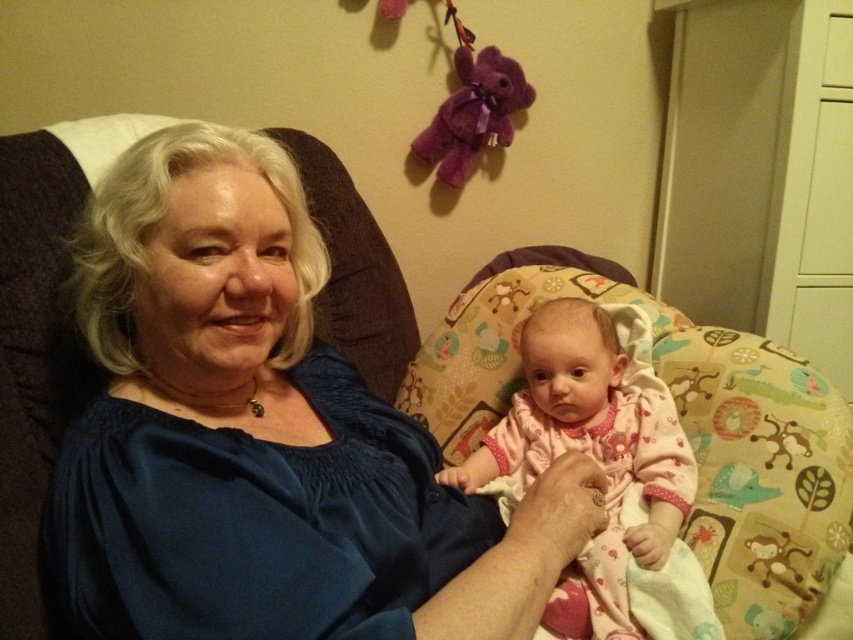
You are a photographer setting up for a family portrait. You need to ensure that the blue satin blouse at upper left and the pink fabric baby at center are both visible in the frame. Based on their heights, which object should be placed closer to the camera to maintain both in focus?

The blue satin blouse at upper left is taller than the pink fabric baby at center, so placing the pink fabric baby at center closer to the camera will help keep both in focus by adjusting their positions according to their sizes.

Based on the scene description, where is the blue satin blouse at upper left located in terms of its 2D coordinates?

The blue satin blouse at upper left is located at the 2D coordinates of point (260, 436).